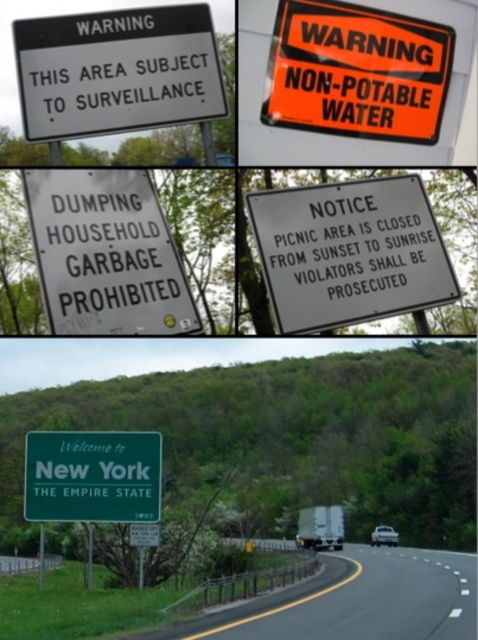
You are driving a car and see the green asphalt road at lower center and the white paper notice at center. Which object is located below the other?

The green asphalt road at lower center is positioned under the white paper notice at center.

You are a delivery driver who needs to deliver a package to the address located on the white paper notice at center. The road you must take is the green asphalt road at lower center. Can your delivery van, which is 2 meters wide, safely pass through this road?

The green asphalt road at lower center is wider than the white paper notice at center, but the description does not provide specific measurements for the road width. Therefore, it is uncertain if the delivery van can safely pass through.